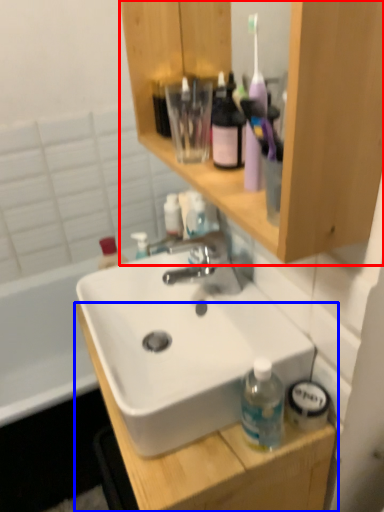
Question: Among these objects, which one is farthest to the camera, bathroom cabinet (highlighted by a red box) or cabinetry (highlighted by a blue box)?

Choices:
 (A) bathroom cabinet
 (B) cabinetry

Answer: (B)